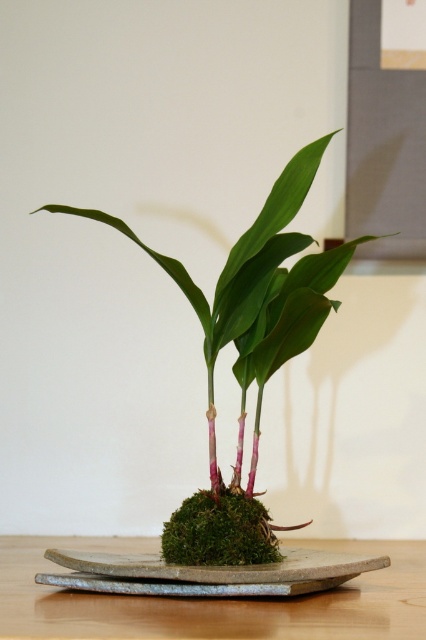
Question: Considering the real-world distances, which object is farthest from the green mossy plant at center?

Choices:
 (A) green moss at center
 (B) gray stone tray at center

Answer: (A)

Question: Which of these objects is positioned closest to the green moss at center?

Choices:
 (A) gray stone tray at center
 (B) green mossy plant at center

Answer: (A)

Question: Can you confirm if green mossy plant at center is wider than green moss at center?

Choices:
 (A) no
 (B) yes

Answer: (A)

Question: Is green moss at center positioned behind gray stone tray at center?

Choices:
 (A) no
 (B) yes

Answer: (A)

Question: Which object is positioned farthest from the green moss at center?

Choices:
 (A) gray stone tray at center
 (B) green mossy plant at center

Answer: (B)

Question: Can you confirm if green mossy plant at center is positioned below gray stone tray at center?

Choices:
 (A) no
 (B) yes

Answer: (A)